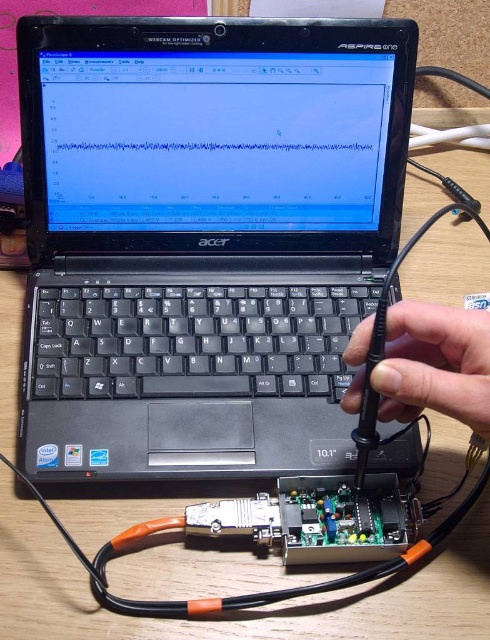
Question: Which point is farther from the camera taking this photo?

Choices:
 (A) (406, 316)
 (B) (215, 209)

Answer: (B)

Question: Which object is farther from the camera taking this photo?

Choices:
 (A) black plastic laptop at center
 (B) black plastic hand at center

Answer: (A)

Question: Considering the relative positions of black plastic laptop at center and black plastic hand at center in the image provided, where is black plastic laptop at center located with respect to black plastic hand at center?

Choices:
 (A) left
 (B) right

Answer: (A)

Question: Where is black plastic laptop at center located in relation to black plastic hand at center in the image?

Choices:
 (A) right
 (B) left

Answer: (B)

Question: Does black plastic laptop at center appear under black plastic hand at center?

Choices:
 (A) yes
 (B) no

Answer: (B)

Question: Which point is farther to the camera?

Choices:
 (A) (409, 28)
 (B) (410, 358)

Answer: (A)